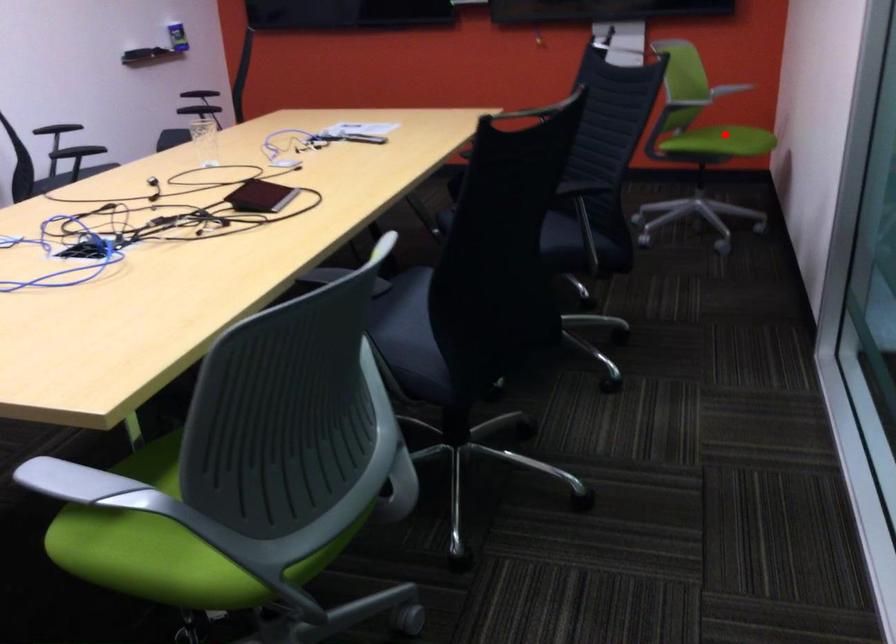
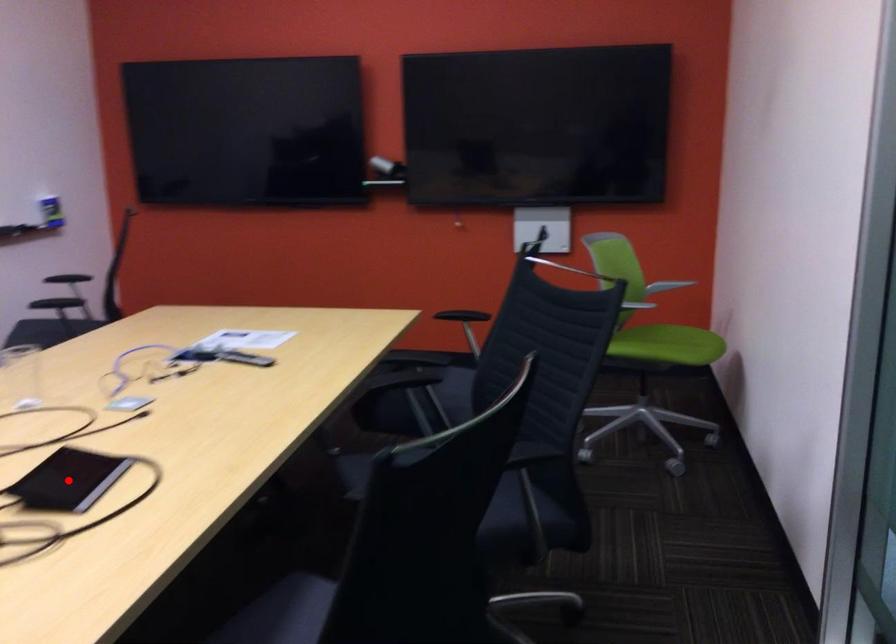
I am providing you with two images of the same scene from different viewpoints. A red point is marked on the first image and another point is marked on the second image. Is the red point in image1 aligned with the point shown in image2?

No